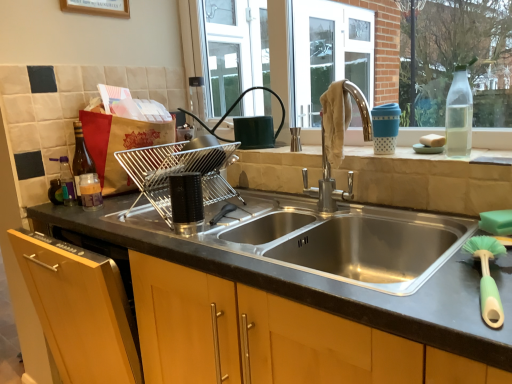
Question: Could you tell me if green plastic brush at lower right is turned towards white sponge at right?

Choices:
 (A) yes
 (B) no

Answer: (B)

Question: Is green plastic brush at lower right further to camera compared to white sponge at right?

Choices:
 (A) yes
 (B) no

Answer: (B)

Question: Are green plastic brush at lower right and white sponge at right making contact?

Choices:
 (A) yes
 (B) no

Answer: (B)

Question: Is green plastic brush at lower right completely or partially outside of white sponge at right?

Choices:
 (A) yes
 (B) no

Answer: (A)

Question: From a real-world perspective, is green plastic brush at lower right physically below white sponge at right?

Choices:
 (A) no
 (B) yes

Answer: (B)

Question: Is green plastic brush at lower right smaller than white sponge at right?

Choices:
 (A) no
 (B) yes

Answer: (A)

Question: From the image's perspective, is green plastic brush at lower right located above metallic silver dish rack at sink, the 2th appliance positioned from the front?

Choices:
 (A) yes
 (B) no

Answer: (B)

Question: Is metallic silver dish rack at sink, the 1th appliance from the back, at the back of green plastic brush at lower right?

Choices:
 (A) no
 (B) yes

Answer: (A)

Question: Can you confirm if green plastic brush at lower right is taller than metallic silver dish rack at sink, the 1th appliance from the back?

Choices:
 (A) yes
 (B) no

Answer: (B)

Question: Is green plastic brush at lower right aimed at metallic silver dish rack at sink, the 2th appliance positioned from the front?

Choices:
 (A) yes
 (B) no

Answer: (B)

Question: Is green plastic brush at lower right outside of metallic silver dish rack at sink, the 1th appliance from the back?

Choices:
 (A) no
 (B) yes

Answer: (B)

Question: Is green plastic brush at lower right closer to camera compared to metallic silver dish rack at sink, the 1th appliance from the back?

Choices:
 (A) no
 (B) yes

Answer: (B)

Question: Is transparent glass bottle at upper right, which is the 1th bottle from front to back, positioned before green plastic brush at lower right?

Choices:
 (A) no
 (B) yes

Answer: (A)